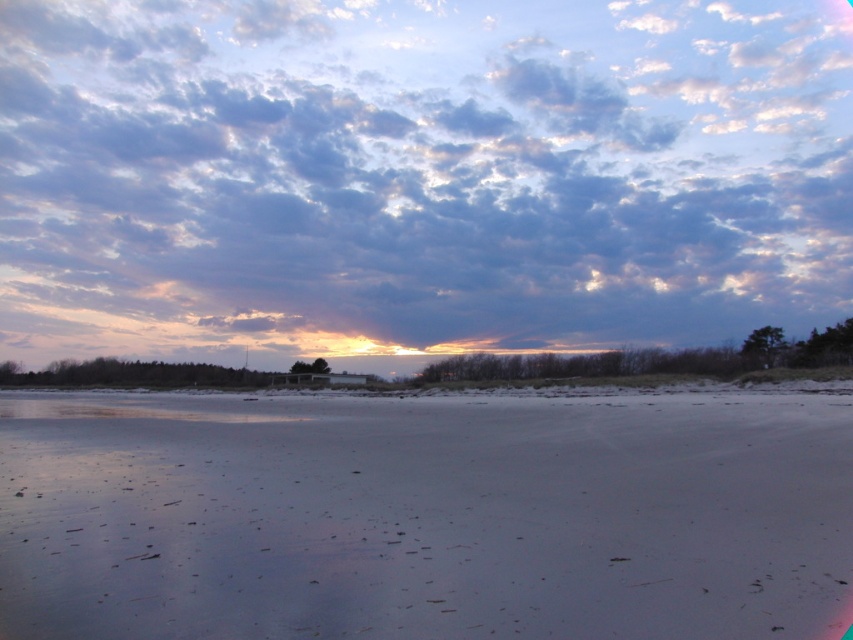
You are standing on the beach and looking up at the cloudy sky at upper center and the white sandy beach at center. Which one appears bigger in the scene?

The cloudy sky at upper center appears bigger than the white sandy beach at center because it has a larger size in the scene.

You are a photographer standing on the beach and want to capture both the cloudy sky at upper center and the white sandy beach at center in a single shot. Based on their distance apart, can you estimate if a standard 50mm lens will allow you to include both in your frame?

The cloudy sky at upper center and white sandy beach at center are 105.02 meters apart. A standard 50mm lens has a field of view that can typically capture about 46 degrees, which would allow you to include both elements if they are within that angle. However, since the distance between them is over 100 meters, it might be challenging to fit both into the frame without moving closer or using a wider lens.